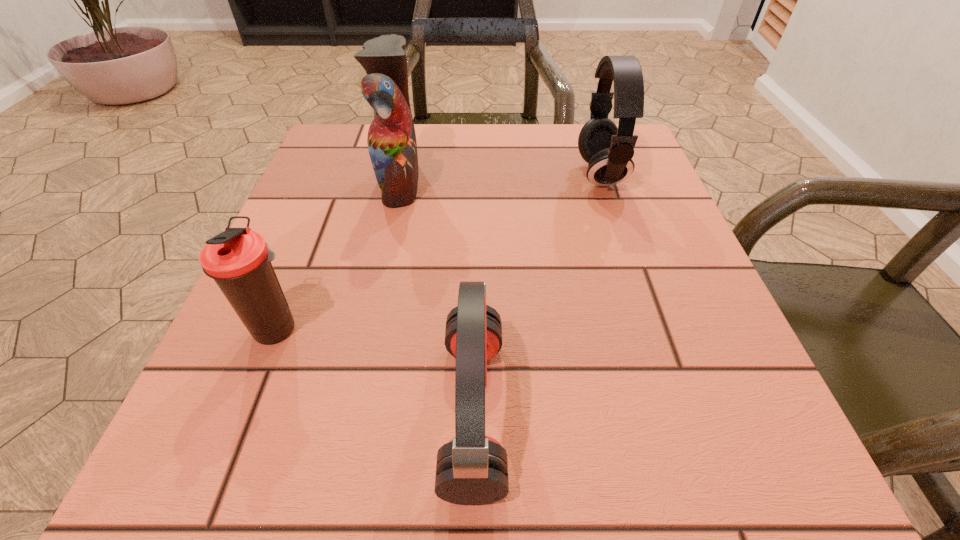
Identify the location of free location located 0.080m on the right of the leftmost object. (362, 328).

I want to click on vacant area situated on the ear cups of the shorter earphone, so click(x=686, y=411).

Where is `parrot that is positioned at the far edge`? parrot that is positioned at the far edge is located at coordinates (392, 145).

You are a GUI agent. You are given a task and a screenshot of the screen. Output one action in this format:
    pyautogui.click(x=<x>, y=<y>)
    Task: Click on the earphone at the far edge
    This screenshot has width=960, height=540.
    Given the screenshot: What is the action you would take?
    pyautogui.click(x=609, y=150)

Image resolution: width=960 pixels, height=540 pixels. Identify the location of object located at the near edge. (471, 469).

Find the location of a particular element. The image size is (960, 540). parrot positioned at the left edge is located at coordinates (392, 145).

I want to click on thermos bottle that is at the left edge, so click(x=239, y=260).

Locate an element on the screen. object that is at the right edge is located at coordinates (609, 150).

Where is `object situated at the far left corner`? object situated at the far left corner is located at coordinates (392, 145).

This screenshot has height=540, width=960. I want to click on object located in the far right corner section of the desktop, so [x=609, y=150].